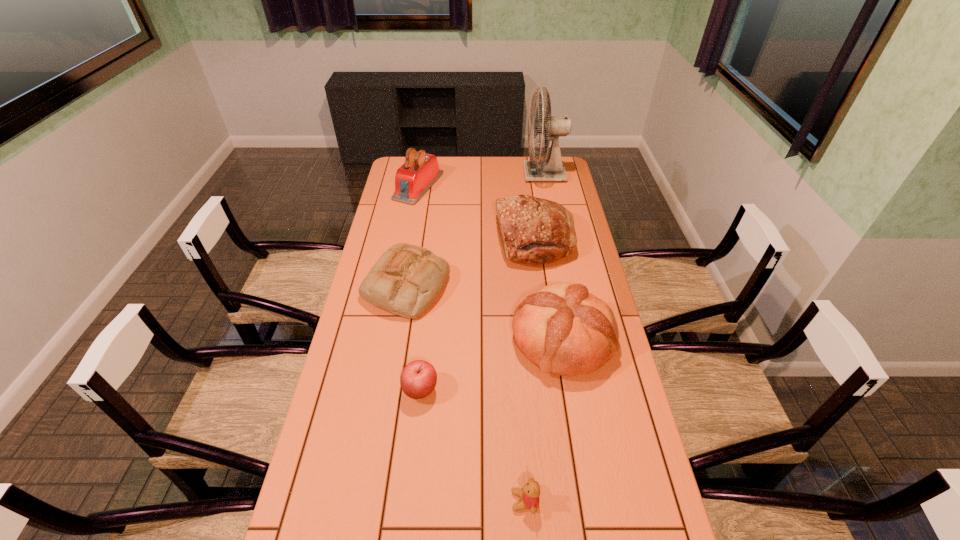
The height and width of the screenshot is (540, 960). What are the coordinates of `the tallest object` in the screenshot? It's located at (552, 169).

Where is `toaster`? This screenshot has width=960, height=540. toaster is located at coordinates (415, 177).

I want to click on the leftmost bread, so click(406, 280).

Identify the location of the third shortest object. The image size is (960, 540). (406, 280).

Find the location of a particular element. The width and height of the screenshot is (960, 540). apple is located at coordinates (418, 379).

Identify the location of teddy bear. Image resolution: width=960 pixels, height=540 pixels. click(x=530, y=493).

Where is `free spot located 0.080m on the front-facing side of the fan`? The width and height of the screenshot is (960, 540). free spot located 0.080m on the front-facing side of the fan is located at coordinates (508, 174).

Locate an element on the screen. This screenshot has height=540, width=960. vacant area situated on the front-facing side of the fan is located at coordinates (480, 174).

Where is `vacant area situated 0.160m on the front-facing side of the fan`? This screenshot has width=960, height=540. vacant area situated 0.160m on the front-facing side of the fan is located at coordinates (492, 174).

In order to click on free region located on the right of the toaster in this screenshot , I will do `click(479, 186)`.